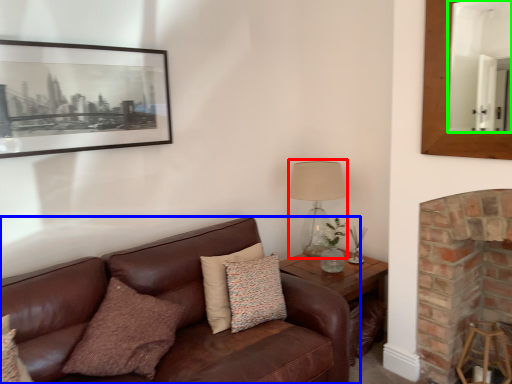
Question: Which object is positioned farthest from table lamp (highlighted by a red box)? Select from studio couch (highlighted by a blue box) and mirror (highlighted by a green box).

Choices:
 (A) studio couch
 (B) mirror

Answer: (B)